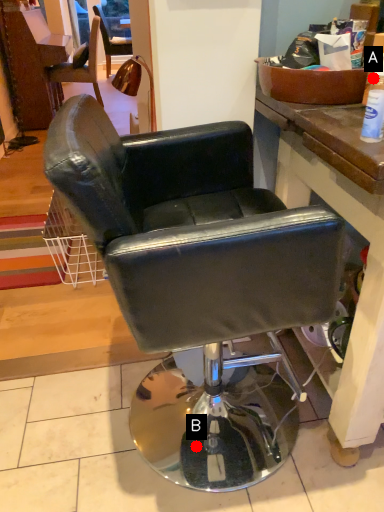
Question: Two points are circled on the image, labeled by A and B beside each circle. Which point is further to the camera?

Choices:
 (A) A is further
 (B) B is further

Answer: (B)